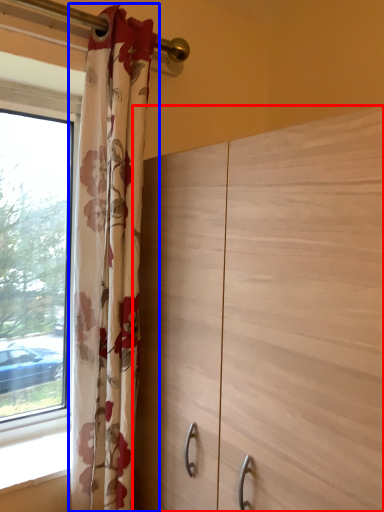
Question: Which object appears closest to the camera in this image, dresser (highlighted by a red box) or curtain (highlighted by a blue box)?

Choices:
 (A) dresser
 (B) curtain

Answer: (A)